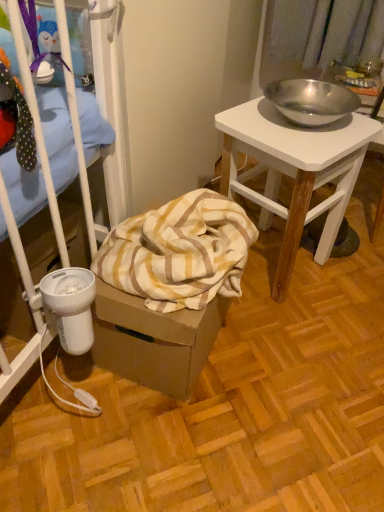
The height and width of the screenshot is (512, 384). Identify the location of polished metal bowl at upper right. (294, 172).

Image resolution: width=384 pixels, height=512 pixels. Describe the element at coordinates (294, 172) in the screenshot. I see `polished metal bowl at upper right` at that location.

What do you see at coordinates (179, 252) in the screenshot?
I see `yellow striped fabric at lower left` at bounding box center [179, 252].

Where is `yellow striped fabric at lower left`? The image size is (384, 512). yellow striped fabric at lower left is located at coordinates pyautogui.click(x=179, y=252).

Based on the photo, what is the approximate height of yellow striped fabric at lower left?

The height of yellow striped fabric at lower left is 6.08 inches.

At what (x,y) coordinates should I click in order to perform the action: click on polished metal bowl at upper right. Please return your answer as a coordinate pair (x, y). The height and width of the screenshot is (512, 384). Looking at the image, I should click on (294, 172).

Considering the positions of objects polished metal bowl at upper right and yellow striped fabric at lower left in the image provided, who is more to the right, polished metal bowl at upper right or yellow striped fabric at lower left?

From the viewer's perspective, polished metal bowl at upper right appears more on the right side.

Which is in front, polished metal bowl at upper right or yellow striped fabric at lower left?

yellow striped fabric at lower left is in front.

Which is closer, (357, 154) or (213, 297)?

The point (213, 297) is closer.

From the image's perspective, is polished metal bowl at upper right positioned above or below yellow striped fabric at lower left?

polished metal bowl at upper right is situated higher than yellow striped fabric at lower left in the image.

From a real-world perspective, is polished metal bowl at upper right physically located above or below yellow striped fabric at lower left?

polished metal bowl at upper right is situated lower than yellow striped fabric at lower left in the real world.

Considering the sizes of objects polished metal bowl at upper right and yellow striped fabric at lower left in the image provided, who is thinner, polished metal bowl at upper right or yellow striped fabric at lower left?

With smaller width is polished metal bowl at upper right.

Considering the relative sizes of polished metal bowl at upper right and yellow striped fabric at lower left in the image provided, is polished metal bowl at upper right taller than yellow striped fabric at lower left?

Correct, polished metal bowl at upper right is much taller as yellow striped fabric at lower left.

Can you confirm if polished metal bowl at upper right is smaller than yellow striped fabric at lower left?

No, polished metal bowl at upper right is not smaller than yellow striped fabric at lower left.

Consider the image. Is polished metal bowl at upper right completely or partially outside of yellow striped fabric at lower left?

Yes, polished metal bowl at upper right is outside of yellow striped fabric at lower left.

Does polished metal bowl at upper right touch yellow striped fabric at lower left?

No, polished metal bowl at upper right is not making contact with yellow striped fabric at lower left.

Could you tell me if polished metal bowl at upper right is facing yellow striped fabric at lower left?

No, polished metal bowl at upper right is not oriented towards yellow striped fabric at lower left.

Identify the location of blanket below the polished metal bowl at upper right (from the image's perspective). The width and height of the screenshot is (384, 512). (179, 252).

Does yellow striped fabric at lower left appear on the left side of polished metal bowl at upper right?

Yes, yellow striped fabric at lower left is to the left of polished metal bowl at upper right.

Looking at this image, who is more distant, yellow striped fabric at lower left or polished metal bowl at upper right?

polished metal bowl at upper right is behind.

Considering the points (200, 210) and (334, 207), which point is behind, point (200, 210) or point (334, 207)?

The point (334, 207) is farther.

From the image's perspective, is yellow striped fabric at lower left beneath polished metal bowl at upper right?

Indeed, from the image's perspective, yellow striped fabric at lower left is shown beneath polished metal bowl at upper right.

From a real-world perspective, which object rests below the other?

polished metal bowl at upper right, from a real-world perspective.

Looking at this image, which of these two, yellow striped fabric at lower left or polished metal bowl at upper right, is wider?

With larger width is yellow striped fabric at lower left.

From the picture: Can you confirm if yellow striped fabric at lower left is taller than polished metal bowl at upper right?

No.

Based on their sizes in the image, would you say yellow striped fabric at lower left is bigger or smaller than polished metal bowl at upper right?

In the image, yellow striped fabric at lower left appears to be smaller than polished metal bowl at upper right.

Which is correct: yellow striped fabric at lower left is inside polished metal bowl at upper right, or outside of it?

yellow striped fabric at lower left is outside polished metal bowl at upper right.

Is the surface of yellow striped fabric at lower left in direct contact with polished metal bowl at upper right?

No, yellow striped fabric at lower left is not in contact with polished metal bowl at upper right.

Is yellow striped fabric at lower left oriented towards polished metal bowl at upper right?

No.

How different are the orientations of yellow striped fabric at lower left and polished metal bowl at upper right in degrees?

The angular difference between yellow striped fabric at lower left and polished metal bowl at upper right is 24.6 degrees.

Image resolution: width=384 pixels, height=512 pixels. I want to click on blanket that is above the polished metal bowl at upper right (from a real-world perspective), so click(x=179, y=252).

You are a GUI agent. You are given a task and a screenshot of the screen. Output one action in this format:
    pyautogui.click(x=<x>, y=<y>)
    Task: Click on the blanket in front of the polished metal bowl at upper right
    The height and width of the screenshot is (512, 384).
    Given the screenshot: What is the action you would take?
    pyautogui.click(x=179, y=252)

I want to click on blanket that appears above the polished metal bowl at upper right (from a real-world perspective), so click(179, 252).